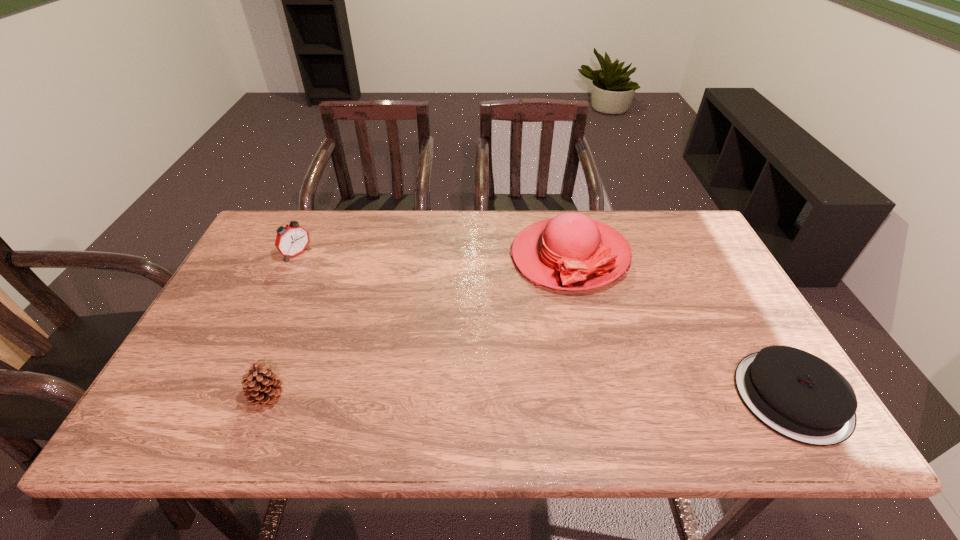
Locate an element on the screen. Image resolution: width=960 pixels, height=540 pixels. pinecone is located at coordinates (261, 387).

Locate an element on the screen. the rightmost object is located at coordinates (799, 396).

Locate an element on the screen. This screenshot has height=540, width=960. the shortest object is located at coordinates (799, 396).

Locate an element on the screen. The height and width of the screenshot is (540, 960). the leftmost object is located at coordinates (291, 240).

Find the location of a particular element. The width and height of the screenshot is (960, 540). the tallest object is located at coordinates (571, 251).

At what (x,y) coordinates should I click in order to perform the action: click on the second object from right to left. Please return your answer as a coordinate pair (x, y). Looking at the image, I should click on (571, 251).

Image resolution: width=960 pixels, height=540 pixels. Find the location of `vacant region located on the right of the second object from left to right`. vacant region located on the right of the second object from left to right is located at coordinates (432, 397).

Locate an element on the screen. The height and width of the screenshot is (540, 960). vacant space situated 0.370m on the left of the shortest object is located at coordinates (572, 397).

Locate an element on the screen. This screenshot has width=960, height=540. vacant space located 0.290m on the clock face of the alarm clock is located at coordinates (362, 309).

Where is `vacant space located on the clock face of the alarm clock`? The height and width of the screenshot is (540, 960). vacant space located on the clock face of the alarm clock is located at coordinates (347, 296).